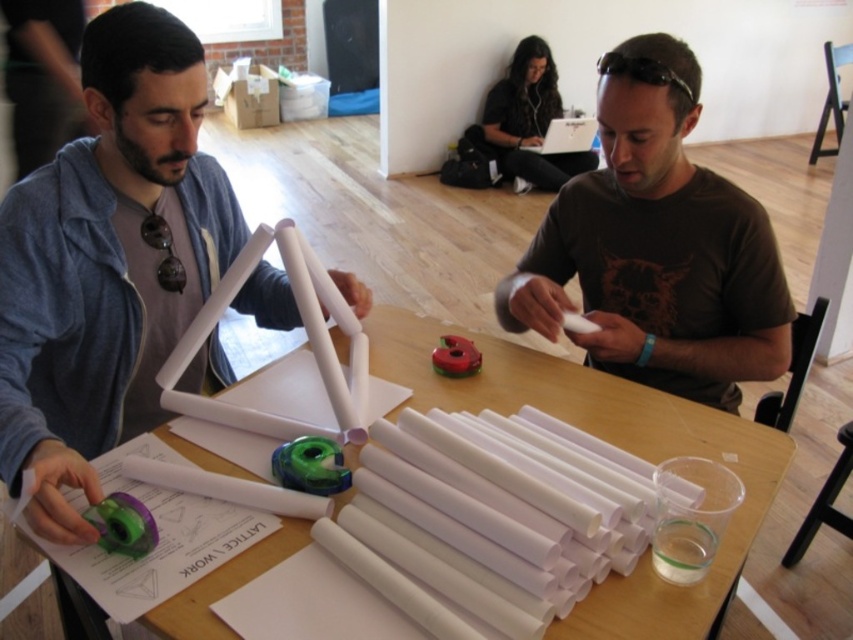
Question: Which object is farther from the camera taking this photo?

Choices:
 (A) white paper at center
 (B) matte white triangle at upper center

Answer: (B)

Question: Can you confirm if brown matte shirt at center is positioned below white paper at center?

Choices:
 (A) yes
 (B) no

Answer: (B)

Question: Which point is closer to the camera taking this photo?

Choices:
 (A) (199, 113)
 (B) (703, 381)
 (C) (230, 464)

Answer: (C)

Question: Which object appears farthest from the camera in this image?

Choices:
 (A) matte white triangle at upper center
 (B) white paper at center

Answer: (A)

Question: Can you confirm if matte white triangle at upper center is bigger than white paper at center?

Choices:
 (A) yes
 (B) no

Answer: (B)

Question: Does matte white triangle at upper center appear over white matte tubes at center?

Choices:
 (A) no
 (B) yes

Answer: (B)